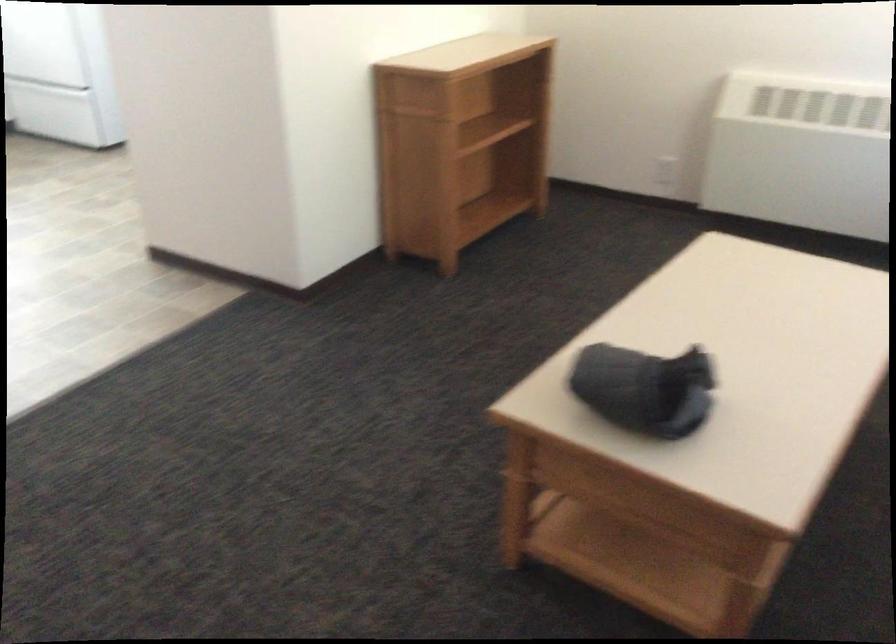
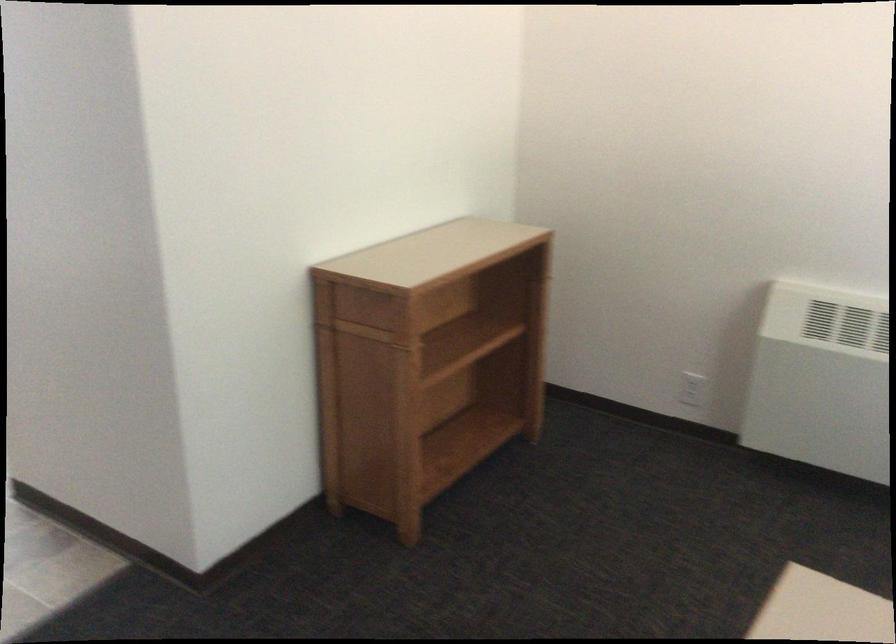
Where in the second image is the point corresponding to [664,173] from the first image?

(692, 389)